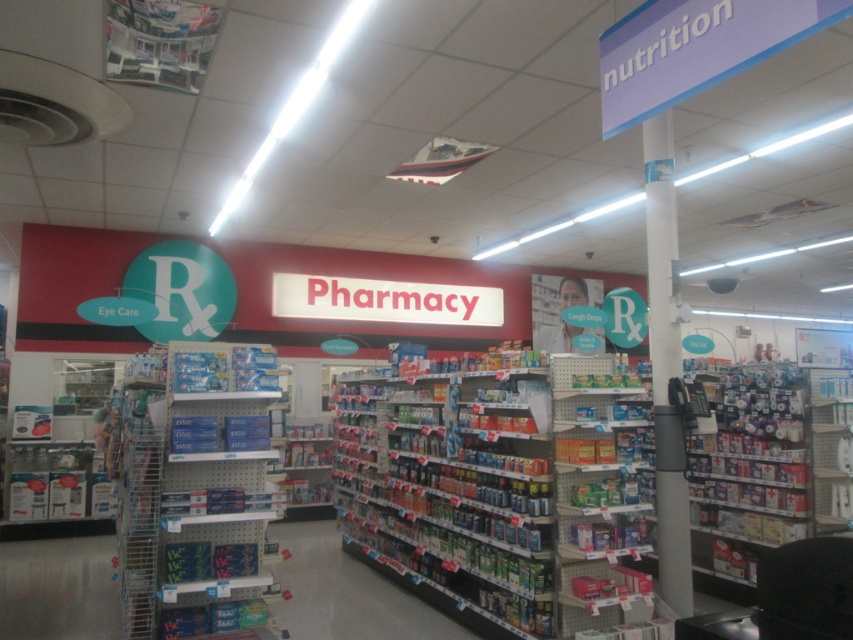
Question: Which point is farther to the camera?

Choices:
 (A) (646, 173)
 (B) (381, 317)

Answer: (B)

Question: Where is white glossy pillar at center-right located in relation to red plastic sign at center in the image?

Choices:
 (A) right
 (B) left

Answer: (A)

Question: Is white glossy pillar at center-right to the right of red plastic sign at center from the viewer's perspective?

Choices:
 (A) no
 (B) yes

Answer: (B)

Question: Is white glossy pillar at center-right thinner than red plastic sign at center?

Choices:
 (A) no
 (B) yes

Answer: (B)

Question: Which point is closer to the camera taking this photo?

Choices:
 (A) (677, 477)
 (B) (495, 321)

Answer: (A)